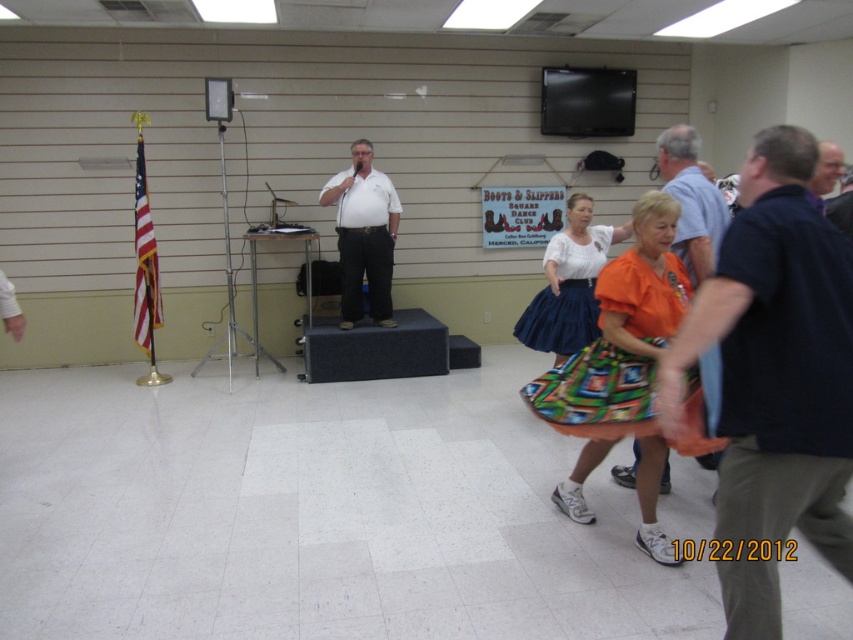
Is white matte shirt at center positioned at the back of orange fabric dress at right?

Yes, it is.

Who is higher up, white matte shirt at center or orange fabric dress at right?

white matte shirt at center

You are a GUI agent. You are given a task and a screenshot of the screen. Output one action in this format:
    pyautogui.click(x=<x>, y=<y>)
    Task: Click on the white matte shirt at center
    
    Given the screenshot: What is the action you would take?
    pyautogui.click(x=364, y=236)

Is point (639, 250) positioned in front of point (589, 205)?

Yes, point (639, 250) is in front of point (589, 205).

Is orange printed skirt at right smaller than velvet blue skirt at center?

Actually, orange printed skirt at right might be larger than velvet blue skirt at center.

Is point (639, 298) behind point (532, 308)?

No.

I want to click on orange printed skirt at right, so click(x=622, y=369).

Does smooth brown hair at upper right have a lesser width compared to metallic silver speaker at upper center?

No.

Can you confirm if smooth brown hair at upper right is positioned below metallic silver speaker at upper center?

Correct, smooth brown hair at upper right is located below metallic silver speaker at upper center.

Where is `smooth brown hair at upper right`? This screenshot has height=640, width=853. smooth brown hair at upper right is located at coordinates (825, 172).

Find the location of a particular element. smooth brown hair at upper right is located at coordinates (825, 172).